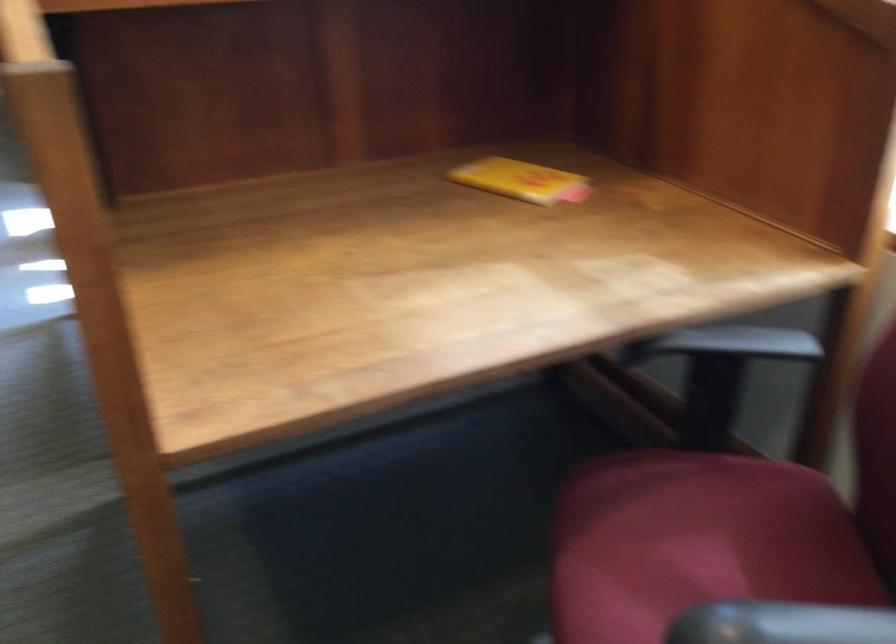
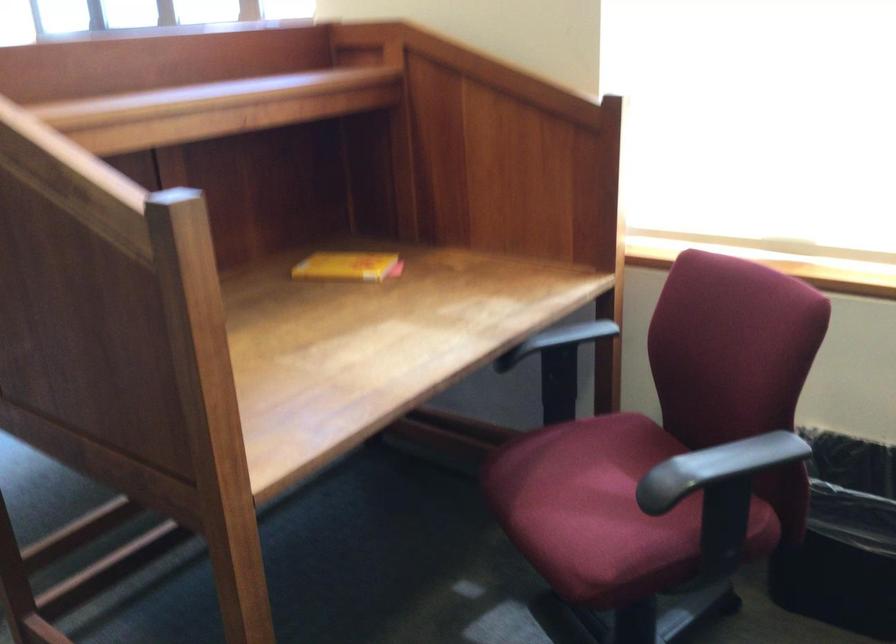
In the second image, find the point that corresponds to (x=519, y=178) in the first image.

(348, 266)